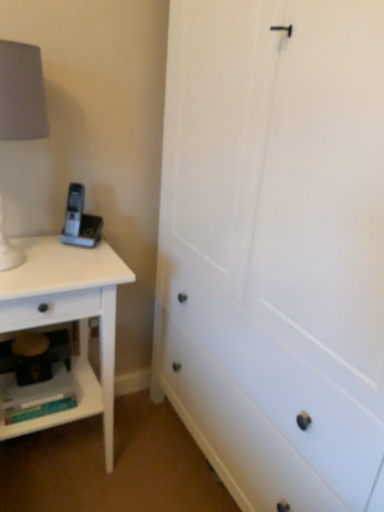
Question: Can you confirm if white matte lampshade at left is shorter than white matte nightstand at left?

Choices:
 (A) yes
 (B) no

Answer: (A)

Question: Could you tell me if white matte lampshade at left is facing white matte nightstand at left?

Choices:
 (A) no
 (B) yes

Answer: (A)

Question: Is white matte lampshade at left placed right next to white matte nightstand at left?

Choices:
 (A) no
 (B) yes

Answer: (A)

Question: From the image's perspective, is white matte lampshade at left located above white matte nightstand at left?

Choices:
 (A) no
 (B) yes

Answer: (B)

Question: Is white matte lampshade at left positioned in front of white matte nightstand at left?

Choices:
 (A) yes
 (B) no

Answer: (A)

Question: Considering the positions of white matte nightstand at left and matte plastic shelf at lower left in the image, is white matte nightstand at left taller or shorter than matte plastic shelf at lower left?

Choices:
 (A) tall
 (B) short

Answer: (A)

Question: Choose the correct answer: Is white matte nightstand at left inside matte plastic shelf at lower left or outside it?

Choices:
 (A) outside
 (B) inside

Answer: (A)

Question: Is white matte nightstand at left to the left or to the right of matte plastic shelf at lower left in the image?

Choices:
 (A) left
 (B) right

Answer: (B)

Question: From the image's perspective, is white matte nightstand at left above or below matte plastic shelf at lower left?

Choices:
 (A) above
 (B) below

Answer: (A)

Question: From a real-world perspective, relative to white matte nightstand at left, is white matte lampshade at left vertically above or below?

Choices:
 (A) below
 (B) above

Answer: (B)

Question: Does point (26, 121) appear closer or farther from the camera than point (104, 311)?

Choices:
 (A) closer
 (B) farther

Answer: (A)

Question: Relative to white matte nightstand at left, is white matte lampshade at left in front or behind?

Choices:
 (A) behind
 (B) front

Answer: (B)

Question: Is white matte lampshade at left inside or outside of white matte nightstand at left?

Choices:
 (A) inside
 (B) outside

Answer: (B)

Question: From a real-world perspective, is white matte nightstand at left positioned above or below white matte lampshade at left?

Choices:
 (A) above
 (B) below

Answer: (B)

Question: Relative to white matte lampshade at left, is white matte nightstand at left in front or behind?

Choices:
 (A) front
 (B) behind

Answer: (B)